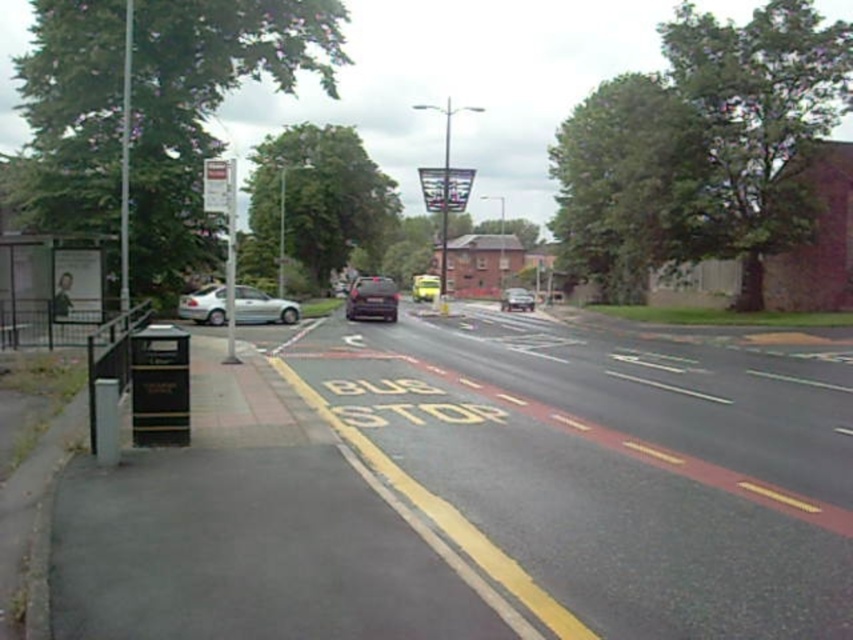
Question: Does silver metallic car at left appear on the right side of satin black car at center?

Choices:
 (A) no
 (B) yes

Answer: (A)

Question: Does silver metallic car at left appear on the right side of satin black car at center?

Choices:
 (A) no
 (B) yes

Answer: (A)

Question: Which object appears closest to the camera in this image?

Choices:
 (A) silver metallic car at center
 (B) silver metallic car at left
 (C) yellow matte car at center
 (D) satin black car at center

Answer: (B)

Question: Estimate the real-world distances between objects in this image. Which object is farther from the yellow matte car at center?

Choices:
 (A) silver metallic car at left
 (B) silver metallic car at center
 (C) satin black car at center

Answer: (A)

Question: Which object is closer to the camera taking this photo?

Choices:
 (A) satin black car at center
 (B) yellow matte car at center
 (C) silver metallic car at center
 (D) silver metallic car at left

Answer: (D)

Question: Is satin black car at center further to the viewer compared to silver metallic car at center?

Choices:
 (A) yes
 (B) no

Answer: (B)